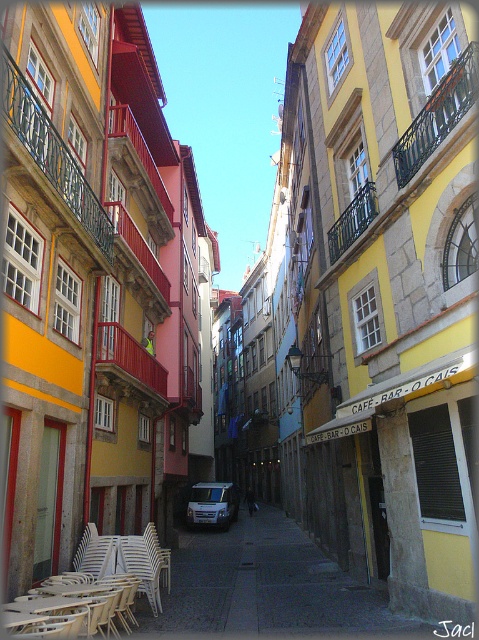
Question: Observing the image, what is the correct spatial positioning of white plastic chairs at lower left in reference to white matte van at center?

Choices:
 (A) below
 (B) above

Answer: (B)

Question: In this image, where is white plastic chairs at lower left located relative to white matte van at center?

Choices:
 (A) above
 (B) below

Answer: (A)

Question: Among these points, which one is nearest to the camera?

Choices:
 (A) (154, 570)
 (B) (214, 492)

Answer: (A)

Question: Can you confirm if white plastic chairs at lower left is thinner than white matte van at center?

Choices:
 (A) yes
 (B) no

Answer: (A)